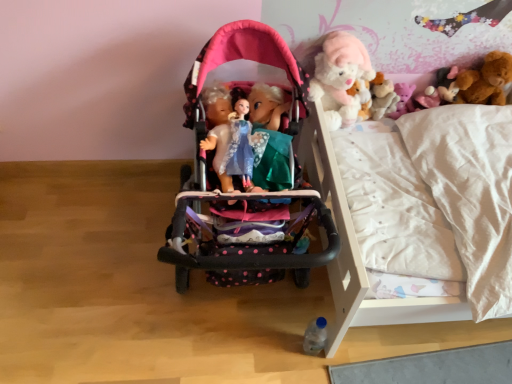
I want to click on free spot to the right of clear plastic bottle at lower center, the fourth toy when ordered from top to bottom, so click(362, 355).